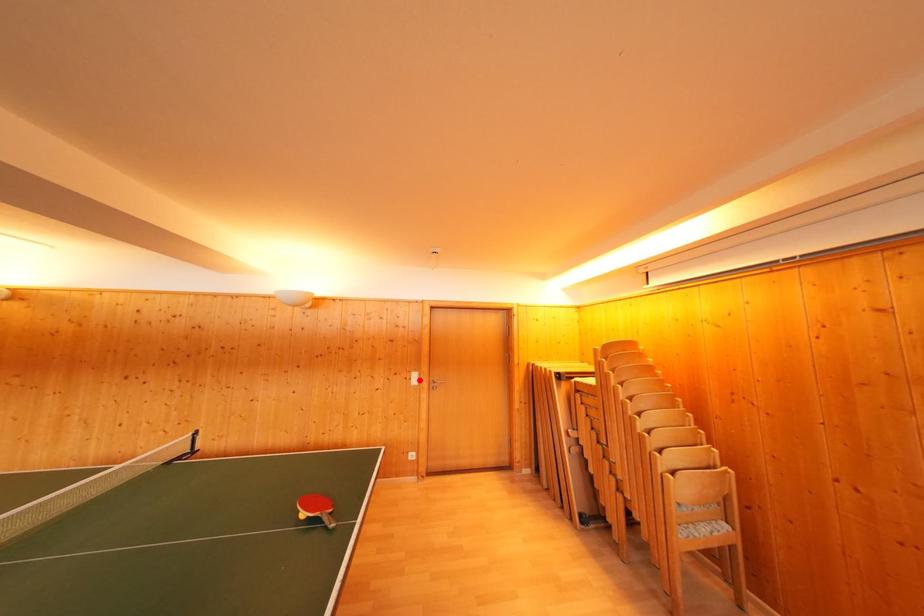
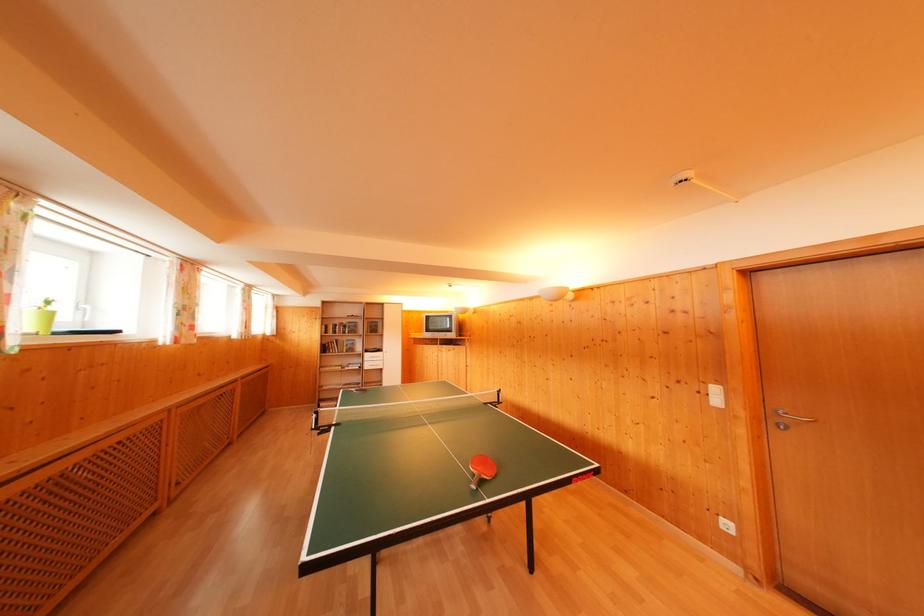
Question: A red point is marked in image1. In image2, is the corresponding 3D point closer to the camera or farther? Reply with the corresponding letter.

Choices:
 (A) The corresponding 3D point is closer.
 (B) The corresponding 3D point is farther.

Answer: (A)